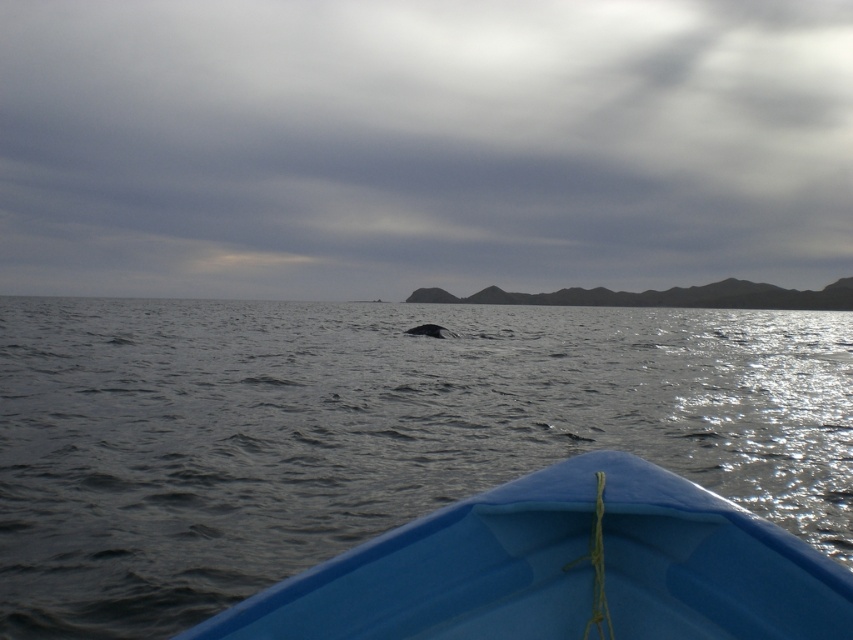
Can you confirm if gray cloudy sky at upper center is taller than blue plastic boat at lower center?

Yes, gray cloudy sky at upper center is taller than blue plastic boat at lower center.

Between gray cloudy sky at upper center and blue plastic boat at lower center, which one has less height?

With less height is blue plastic boat at lower center.

Is point (815, 246) closer to camera compared to point (637, 518)?

That is False.

Where is `gray cloudy sky at upper center`? This screenshot has height=640, width=853. gray cloudy sky at upper center is located at coordinates (421, 147).

Between gray matte water at center and gray matte whale at center, which one is positioned higher?

gray matte water at center is higher up.

Can you confirm if gray matte water at center is bigger than gray matte whale at center?

Indeed, gray matte water at center has a larger size compared to gray matte whale at center.

Between point (654, 381) and point (428, 328), which one is positioned in front?

Point (654, 381)

Identify the location of gray matte water at center. The image size is (853, 640). (367, 433).

Who is shorter, gray matte water at center or blue plastic boat at lower center?

blue plastic boat at lower center

Does gray matte water at center appear on the left side of blue plastic boat at lower center?

Yes, gray matte water at center is to the left of blue plastic boat at lower center.

Who is more distant from viewer, (142, 300) or (437, 628)?

The point (142, 300) is behind.

Identify the location of gray matte water at center. This screenshot has height=640, width=853. click(x=367, y=433).